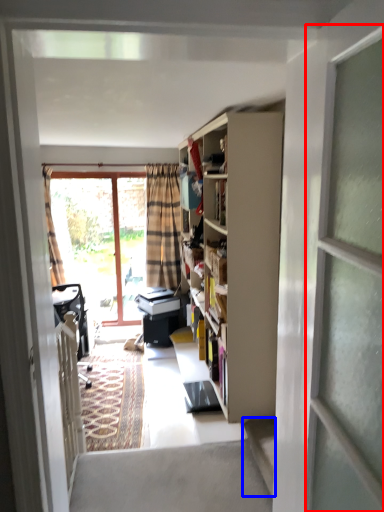
Question: Which point is further to the camera, screen door (highlighted by a red box) or stairwell (highlighted by a blue box)?

Choices:
 (A) screen door
 (B) stairwell

Answer: (B)